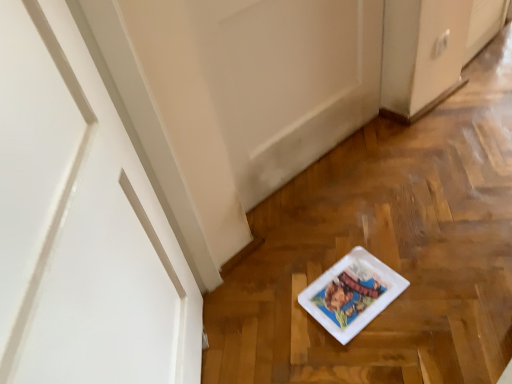
In order to click on vacant area that is in front of white glossy platter at center in this screenshot , I will do `click(383, 346)`.